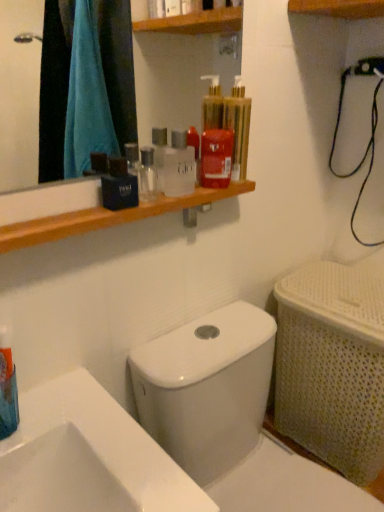
Question: From the image's perspective, relative to translucent plastic mouthwash at upper center, marked as the 5th mouthwash in a left-to-right arrangement, is white glossy toilet at center above or below?

Choices:
 (A) above
 (B) below

Answer: (B)

Question: Is point (183, 408) positioned closer to the camera than point (238, 92)?

Choices:
 (A) farther
 (B) closer

Answer: (A)

Question: Which is nearer to the red glossy mouthwash at upper center, which is the fourth mouthwash in left-to-right order?

Choices:
 (A) white glossy toilet at center
 (B) white glossy sink at lower left
 (C) black matte bag at upper center, the 2th mouthwash from the left
 (D) translucent plastic mouthwash at upper center, positioned as the 1th mouthwash in top-to-bottom order
 (E) wooden shelf at upper center

Answer: (D)

Question: Based on their relative distances, which object is farther from the white glossy toilet at center?

Choices:
 (A) black matte bag at upper center, placed as the fourth mouthwash when sorted from top to bottom
 (B) translucent plastic mouthwash at upper center, marked as the 5th mouthwash in a left-to-right arrangement
 (C) blue plastic toothbrush at lower left, arranged as the fifth mouthwash when viewed from the right
 (D) white glossy sink at lower left
 (E) transparent plastic mouthwash at upper center, acting as the 3th mouthwash starting from the left

Answer: (B)